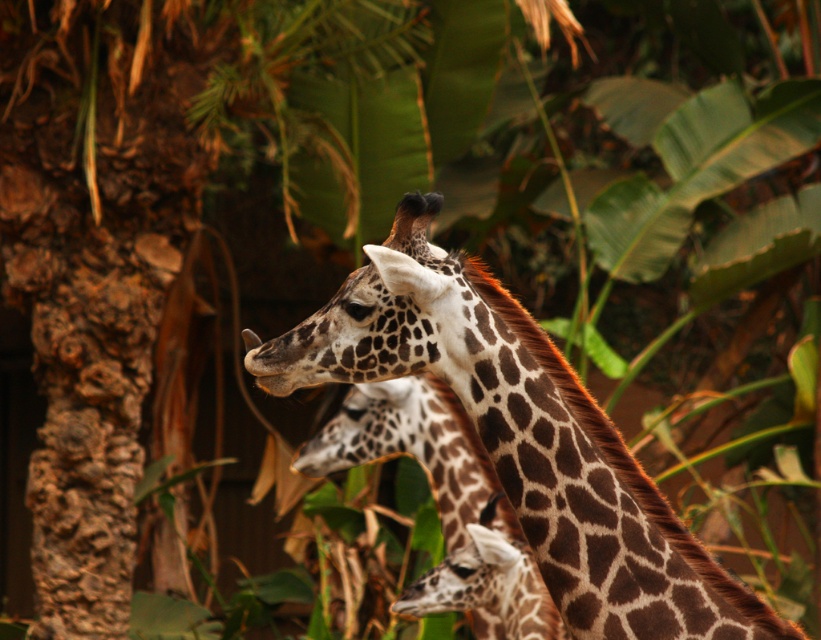
Based on the scene description, where is the spotted fur giraffe at center located in terms of coordinates?

The spotted fur giraffe at center is located at point coordinates of 0.683 and 0.636.

You are a wildlife photographer aiming to capture a clear shot of both the spotted fur giraffe at center and the brown spotted giraffe at center. Based on their positions, which giraffe is closer to the camera?

The spotted fur giraffe at center is closer to the camera because it is positioned over the brown spotted giraffe at center, indicating it is in front.

From the picture: You are standing in front of the two giraffes in the image. You notice two specific points marked as point 1 at coordinates point (620, 525) and point 2 at coordinates point (404, 432). Which point is closer to you?

Point (620, 525) is in front of point (404, 432), so point 1 at coordinates point (620, 525) is closer to you.